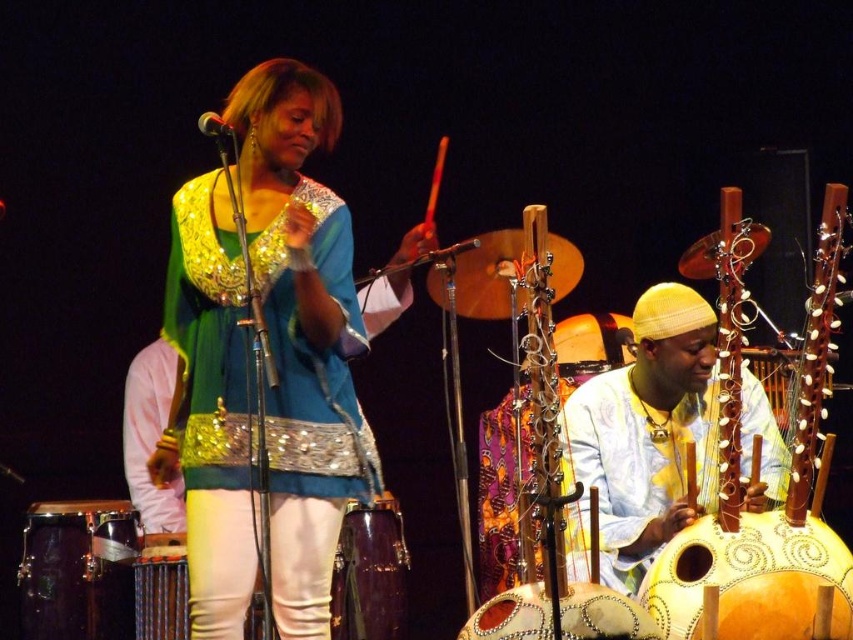
Question: Based on their relative distances, which object is farther from the wooden drum at center?

Choices:
 (A) shiny purple drum at center
 (B) shiny metallic drum at lower left

Answer: (A)

Question: Does wooden drum at center appear on the right side of metallic shiny microphone at upper center?

Choices:
 (A) no
 (B) yes

Answer: (A)

Question: Which point is farther from the camera taking this photo?

Choices:
 (A) (792, 580)
 (B) (273, 172)

Answer: (B)

Question: Can you confirm if yellow wooden drum at center is positioned to the right of shiny gold drum at lower center?

Choices:
 (A) yes
 (B) no

Answer: (A)

Question: Can you confirm if shiny sequined top at center is thinner than wooden drum at lower left?

Choices:
 (A) no
 (B) yes

Answer: (A)

Question: Which object is farther from the camera taking this photo?

Choices:
 (A) shiny sequined top at center
 (B) light blue fabric at center

Answer: (B)